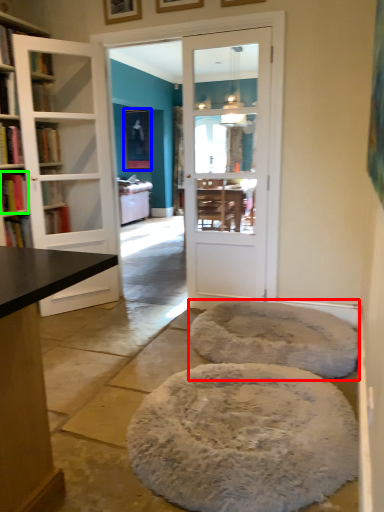
Question: Considering the real-world distances, which object is closest to cat bed (highlighted by a red box)? picture frame (highlighted by a blue box) or book (highlighted by a green box).

Choices:
 (A) picture frame
 (B) book

Answer: (B)